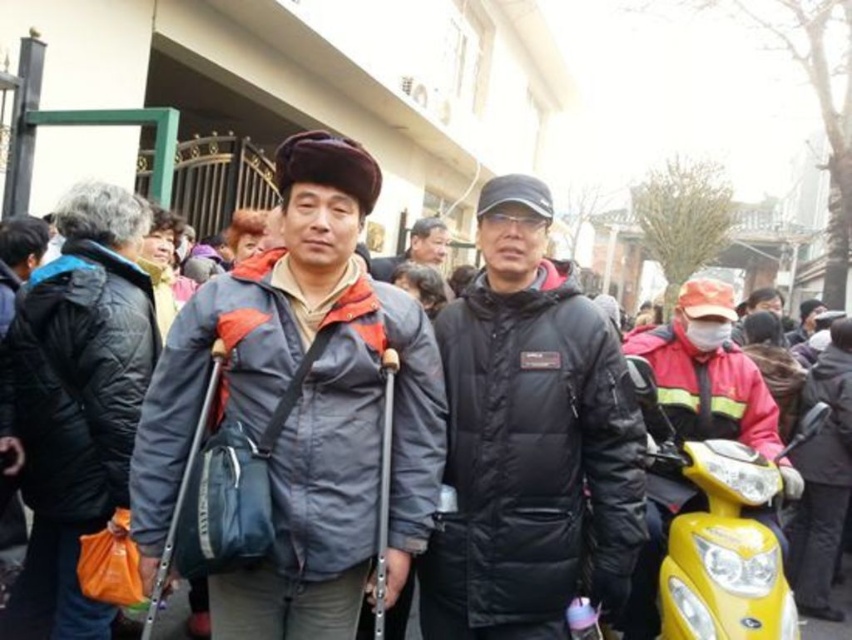
You are a photographer trying to frame two people in the center of your shot. The subjects are wearing a black matte jacket at center and a dark gray puffer jacket at center. Given their jacket sizes, which jacket will require more space in the frame to accommodate its width?

The black matte jacket at center requires more space in the frame because its width is larger than that of the dark gray puffer jacket at center.

From the picture: You are a photographer holding a camera. You want to take a photo of the matte gray jacket at center from a distance that allows you to capture the jacket clearly without distortion. Given that the recommended distance for such photography is between 2 to 2.5 meters, is your current position suitable?

The matte gray jacket at center and camera are 2.30 meters apart from each other. Since the recommended distance is between 2 to 2.5 meters, your current position is suitable to capture the matte gray jacket at center clearly without distortion.

You are a photographer trying to capture a clear shot of both the matte gray jacket at center and the dark gray puffer jacket at center. Based on their positions, which jacket should you focus on first to ensure it appears sharp in the photo?

The matte gray jacket at center is below the dark gray puffer jacket at center, so you should focus on the dark gray puffer jacket at center first since it is higher up and likely in the foreground, ensuring both will be in focus if you start there.